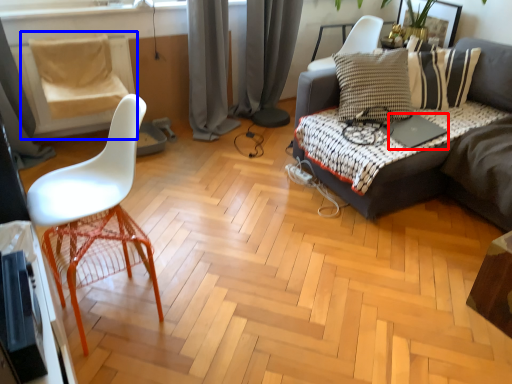
Question: Which point is closer to the camera, laptop (highlighted by a red box) or swivel chair (highlighted by a blue box)?

Choices:
 (A) laptop
 (B) swivel chair

Answer: (A)